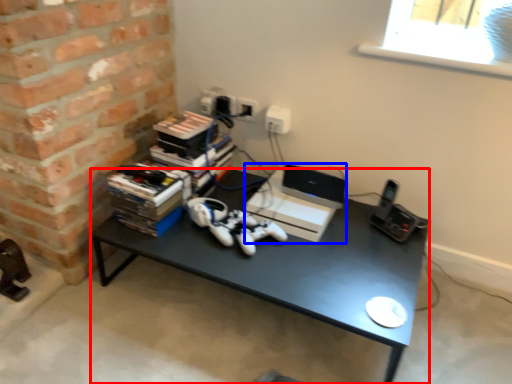
Question: Which object appears closest to the camera in this image, desk (highlighted by a red box) or computer (highlighted by a blue box)?

Choices:
 (A) desk
 (B) computer

Answer: (A)